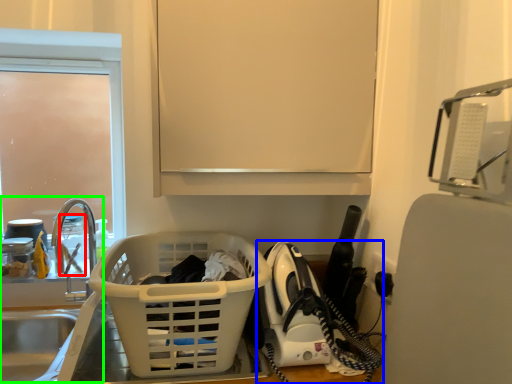
Question: Based on their relative distances, which object is farther from bottle (highlighted by a red box)? Choose from home appliance (highlighted by a blue box) and sink (highlighted by a green box).

Choices:
 (A) home appliance
 (B) sink

Answer: (A)